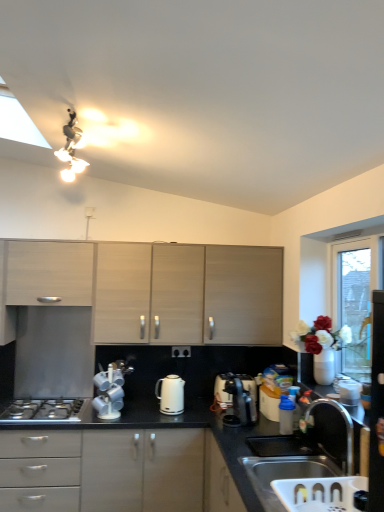
Where is `unoccupied area in front of white glossy electric kettle at center`? unoccupied area in front of white glossy electric kettle at center is located at coordinates (163, 421).